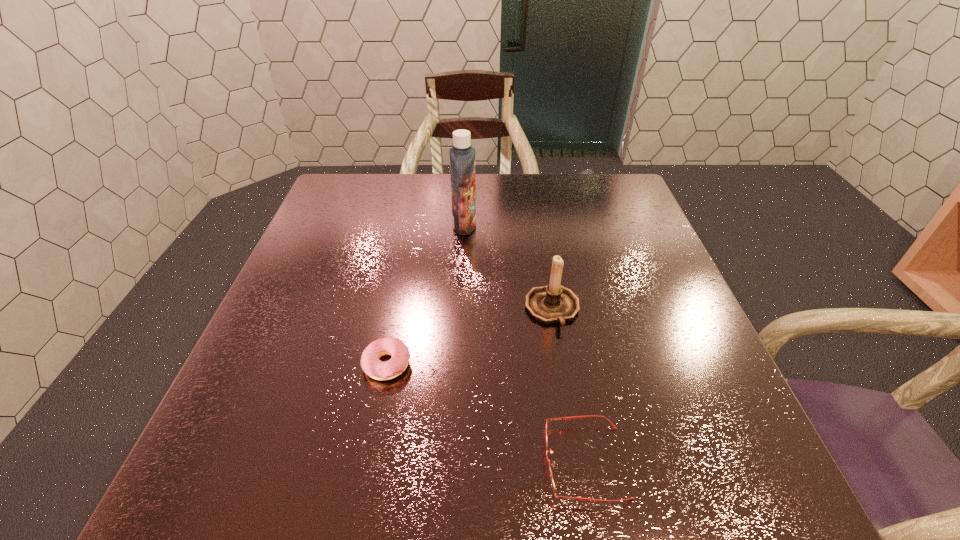
Identify the location of free space between the third farthest object and the candle holder. The image size is (960, 540). (469, 337).

You are a GUI agent. You are given a task and a screenshot of the screen. Output one action in this format:
    pyautogui.click(x=<x>, y=<y>)
    Task: Click on the empty space that is in between the third nearest object and the spectacles
    The image size is (960, 540).
    Given the screenshot: What is the action you would take?
    pyautogui.click(x=568, y=386)

In order to click on vacant space that's between the farthest object and the candle holder in this screenshot , I will do coord(509,267).

Locate an element on the screen. This screenshot has width=960, height=540. free space between the nearest object and the third shortest object is located at coordinates (568, 386).

You are a GUI agent. You are given a task and a screenshot of the screen. Output one action in this format:
    pyautogui.click(x=<x>, y=<y>)
    Task: Click on the unoccupied area between the leftmost object and the nearest object
    
    Given the screenshot: What is the action you would take?
    pyautogui.click(x=486, y=413)

Locate an element on the screen. This screenshot has height=540, width=960. vacant point located between the third object from right to left and the second farthest object is located at coordinates click(x=509, y=267).

Find the location of a particular element. unoccupied position between the third nearest object and the spectacles is located at coordinates (568, 386).

Identify the location of vacant space that is in between the nearest object and the candle holder. (568, 386).

The height and width of the screenshot is (540, 960). I want to click on vacant space that's between the farthest object and the nearest object, so click(x=525, y=343).

Identify the location of vacant space that is in between the nearest object and the doughnut. (486, 413).